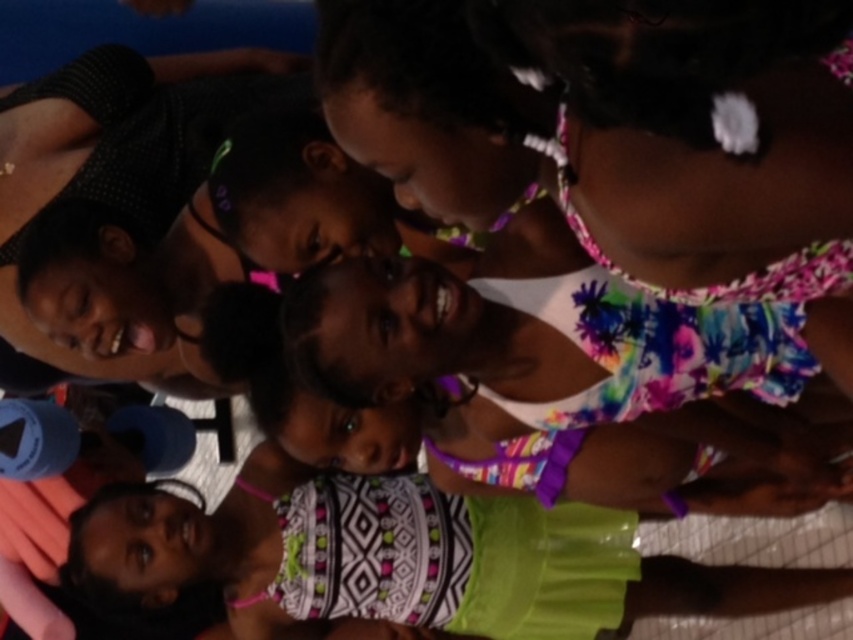
You are a photographer standing at the center of the room. You need to adjust your camera to focus on the matte black hair at upper left. What is the exact coordinate where you should aim your camera?

The matte black hair at upper left is located at point (x=123, y=179), so you should aim your camera at those coordinates to focus on it.